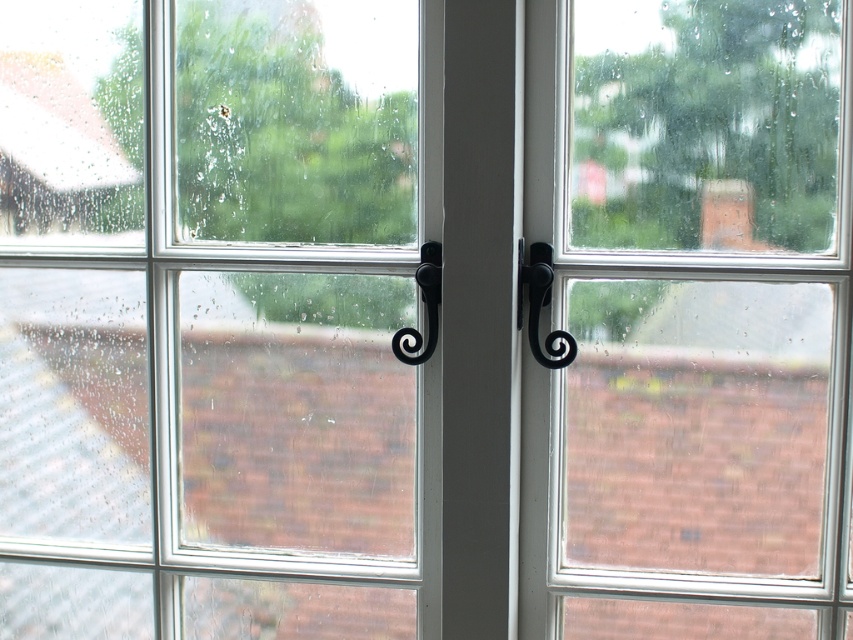
Question: Does clear glass window at right have a larger size compared to black matte door handle at center-right?

Choices:
 (A) yes
 (B) no

Answer: (A)

Question: Among these objects, which one is nearest to the camera?

Choices:
 (A) black matte door handle at center-right
 (B) black matte door handle at center

Answer: (A)

Question: Can you confirm if clear glass window at right is thinner than black matte door handle at center?

Choices:
 (A) yes
 (B) no

Answer: (B)

Question: Which of the following is the closest to the observer?

Choices:
 (A) clear glass window at right
 (B) black matte door handle at center-right
 (C) clear glass window at center
 (D) black matte door handle at center

Answer: (A)

Question: Based on their relative distances, which object is farther from the clear glass window at right?

Choices:
 (A) black matte door handle at center-right
 (B) black matte door handle at center

Answer: (B)

Question: Is clear glass window at right wider than black matte door handle at center-right?

Choices:
 (A) no
 (B) yes

Answer: (B)